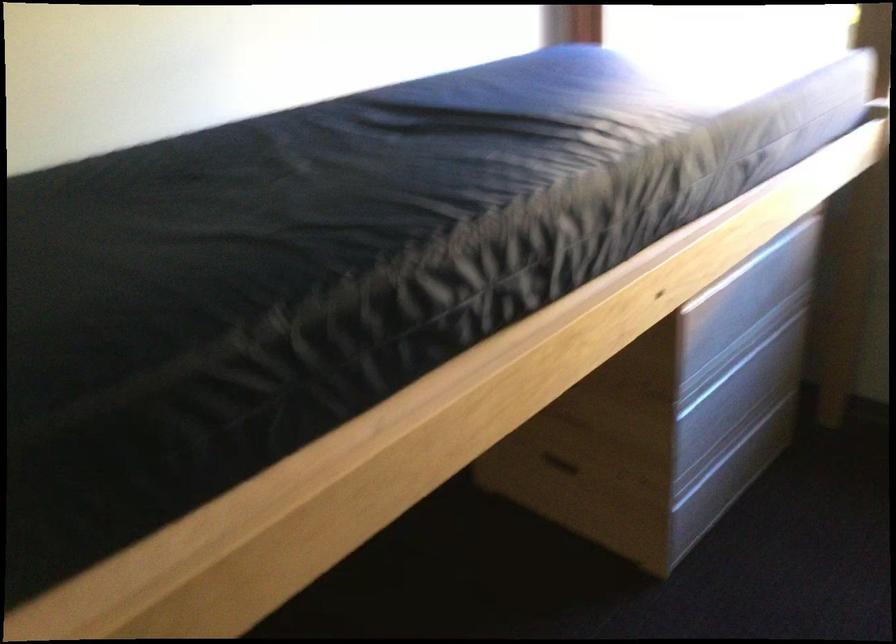
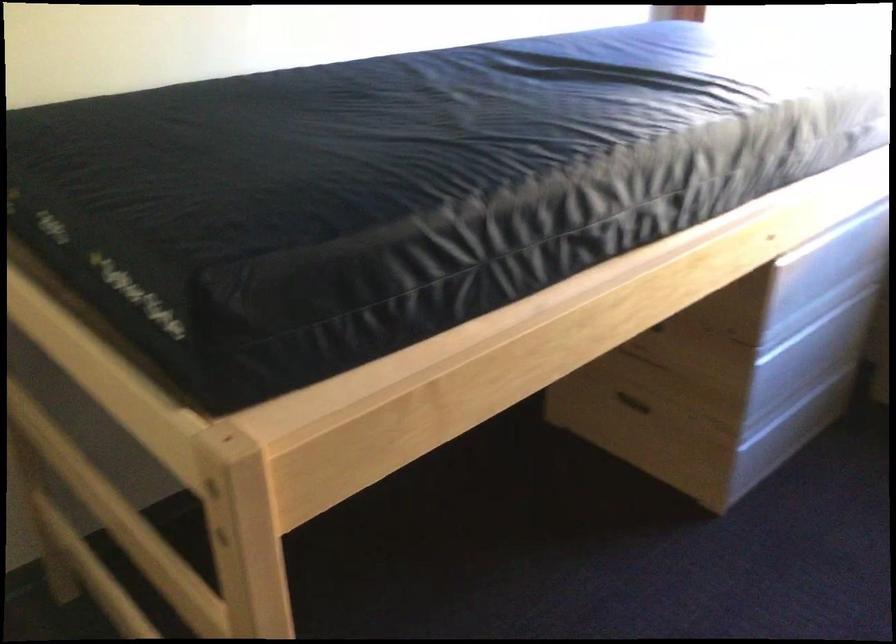
Find the pixel in the second image that matches the point at 561,462 in the first image.

(633, 402)